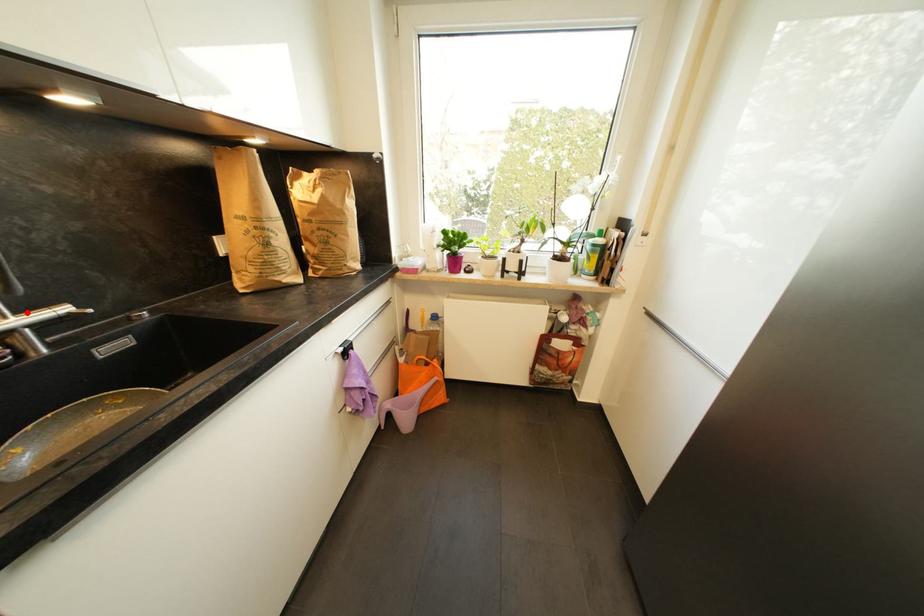
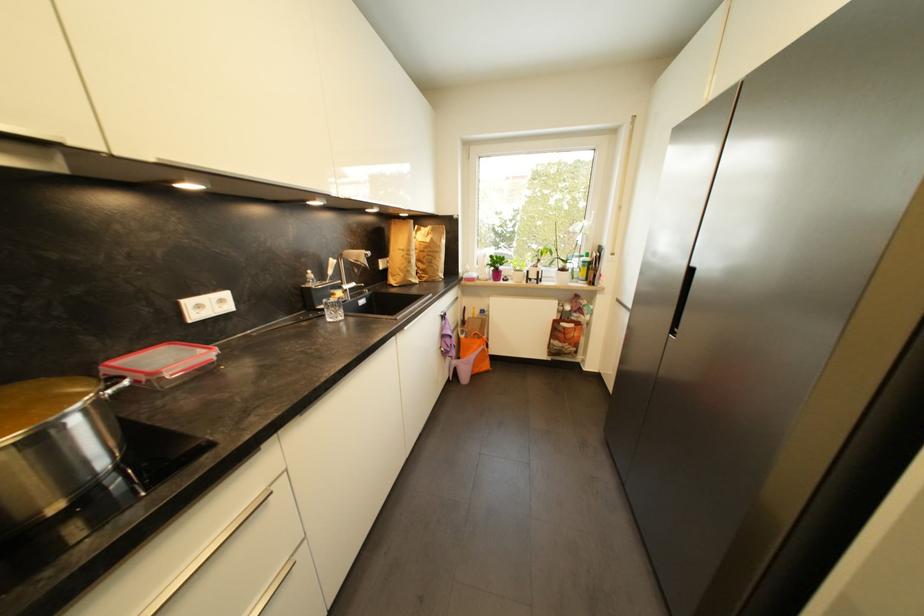
Question: I am providing you with two images of the same scene from different viewpoints. A red point is marked on the first image. Is the red point's position out of view in image 2?

Choices:
 (A) Yes
 (B) No

Answer: (B)